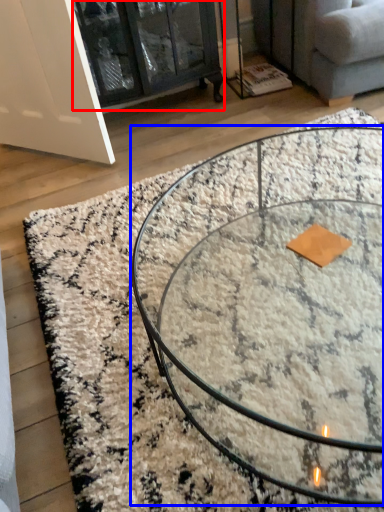
Question: Among these objects, which one is nearest to the camera, glass door (highlighted by a red box) or coffee table (highlighted by a blue box)?

Choices:
 (A) glass door
 (B) coffee table

Answer: (B)